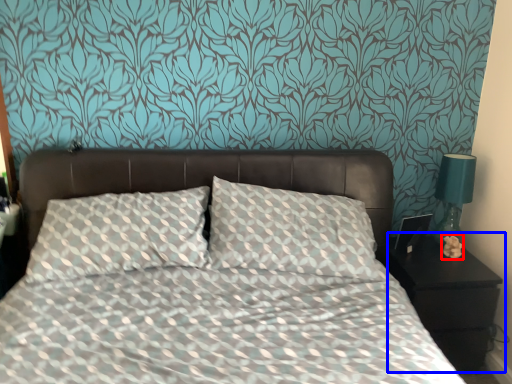
Question: Which object appears closest to the camera in this image, flower (highlighted by a red box) or nightstand (highlighted by a blue box)?

Choices:
 (A) flower
 (B) nightstand

Answer: (B)